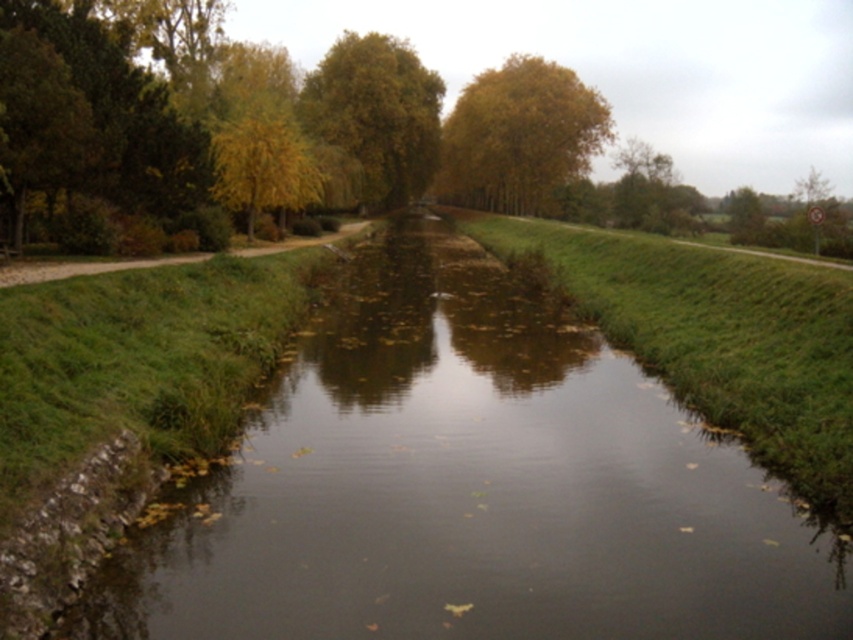
The yellow leafy tree at upper center is represented by point (519, 136). What is the position of the yellow leafy tree at upper center in the image?

The yellow leafy tree at upper center is located at point (519, 136).